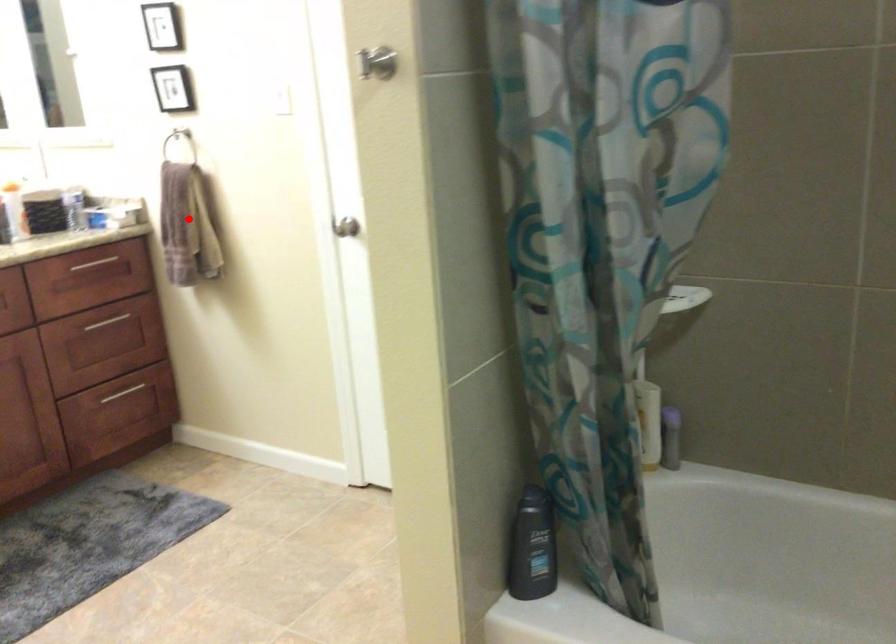
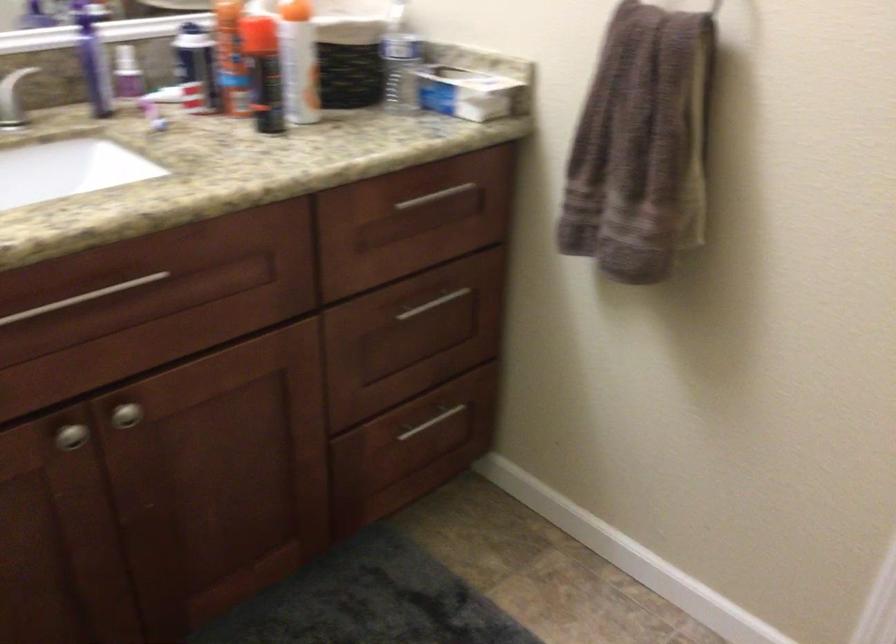
Locate, in the second image, the point that corresponds to the highlighted location in the first image.

(641, 146)